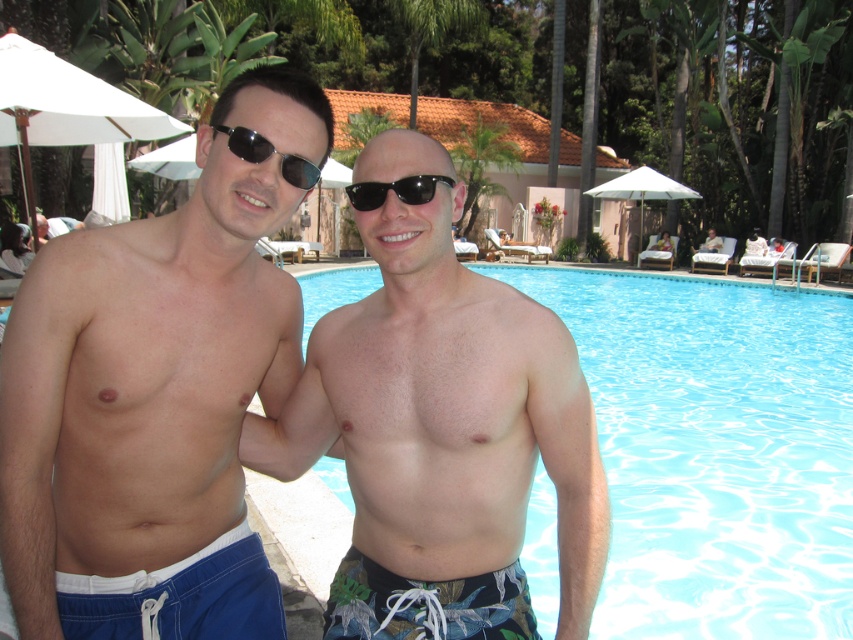
You are a photographer trying to capture the blue fabric shorts at left in your shot. Based on their 2D location coordinates, where should you position your camera to ensure they are centered in the frame?

To center the blue fabric shorts at left in the frame, position your camera so that the center of the viewfinder aligns with the coordinates point (148, 416) where the blue fabric shorts at left are located.

You are a photographer trying to capture the transparent blue water at center in the image. Based on its 2D coordinates, where should you focus your camera lens?

The transparent blue water at center is located at the 2D coordinates point [715,451], so you should focus your camera lens there.